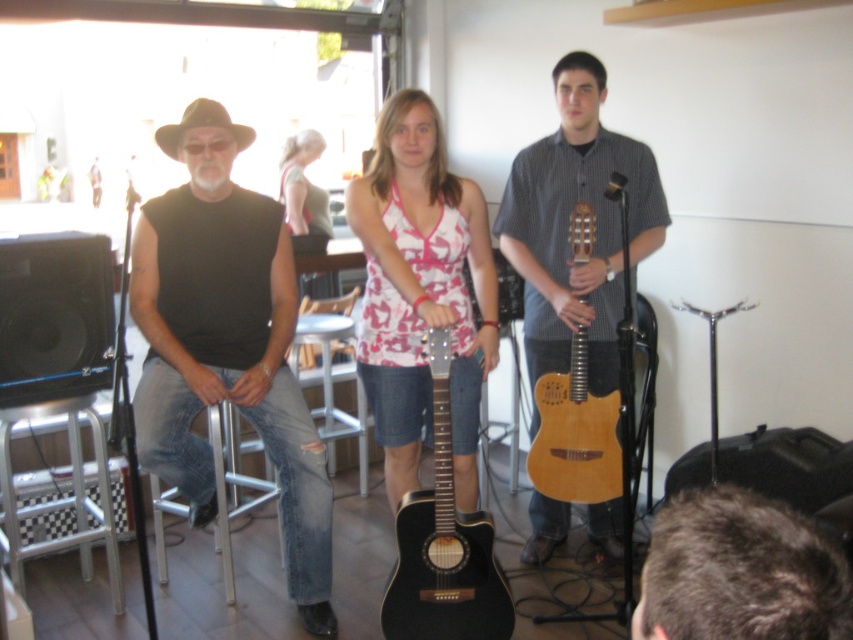
You are a photographer setting up for a group photo. You need to ensure that the dark brown hair at lower right and the natural wood acoustic guitar at center are both visible in the frame. Based on their sizes, which object should you prioritize positioning closer to the camera to maintain clarity?

The dark brown hair at lower right has a lesser width compared to the natural wood acoustic guitar at center, so you should prioritize positioning the dark brown hair at lower right closer to the camera to ensure it remains visible and clear in the photo.

What are the coordinates of the metallic silver bar stool at center?

The metallic silver bar stool at center is located at coordinates point (332, 387).

You are standing in the room and want to greet the person with dark brown hair at lower right. In which direction should you move from your current position to reach them?

The dark brown hair at lower right is located at point 0.894 on the x axis and 0.869 on the y axis. To reach them, you should move towards the lower right direction from your current position.